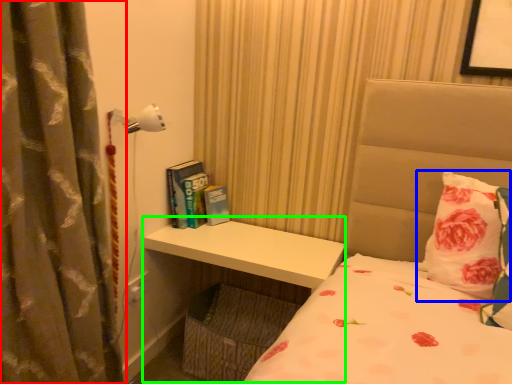
Question: Estimate the real-world distances between objects in this image. Which object is closer to curtain (highlighted by a red box), pillow (highlighted by a blue box) or table (highlighted by a green box)?

Choices:
 (A) pillow
 (B) table

Answer: (B)